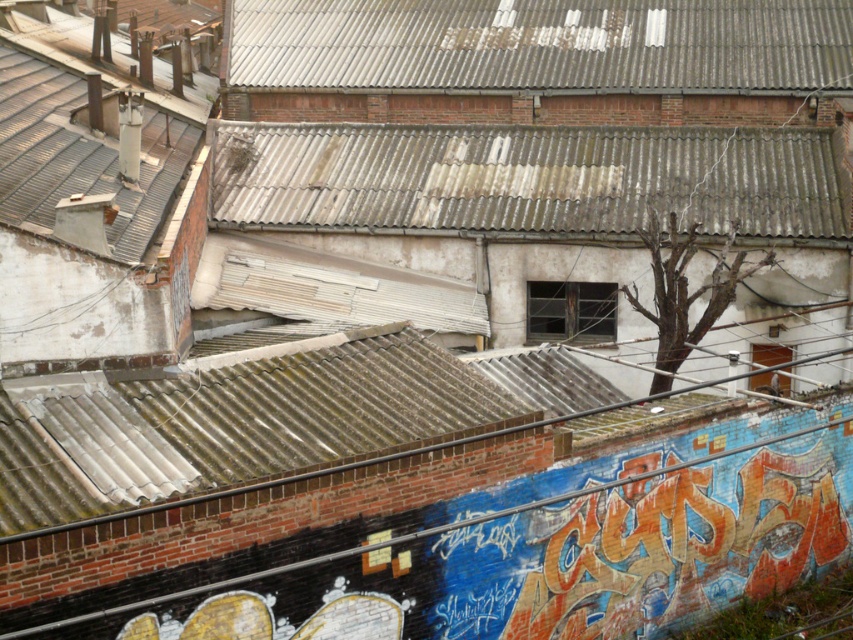
Could you measure the distance between rusty corrugated metal roof at center and rusty corrugated metal roof at upper center?

rusty corrugated metal roof at center is 24.03 meters from rusty corrugated metal roof at upper center.

Is rusty corrugated metal roof at center in front of rusty corrugated metal roof at upper center?

Yes, rusty corrugated metal roof at center is in front of rusty corrugated metal roof at upper center.

Between point (398, 364) and point (579, 51), which one is positioned behind?

Point (579, 51)

Where is `rusty corrugated metal roof at center`? The width and height of the screenshot is (853, 640). rusty corrugated metal roof at center is located at coordinates (233, 426).

Is rusty corrugated metal roof at center further to the viewer compared to rusty metal chimney at upper left?

That is False.

Which is more to the right, rusty corrugated metal roof at center or rusty metal chimney at upper left?

Positioned to the right is rusty corrugated metal roof at center.

What do you see at coordinates (233, 426) in the screenshot? Image resolution: width=853 pixels, height=640 pixels. I see `rusty corrugated metal roof at center` at bounding box center [233, 426].

Where is `rusty corrugated metal roof at center`? The height and width of the screenshot is (640, 853). rusty corrugated metal roof at center is located at coordinates (233, 426).

Can you confirm if weathered metal roof at upper center is smaller than rusty corrugated metal roof at center?

Actually, weathered metal roof at upper center might be larger than rusty corrugated metal roof at center.

The height and width of the screenshot is (640, 853). Identify the location of weathered metal roof at upper center. (527, 179).